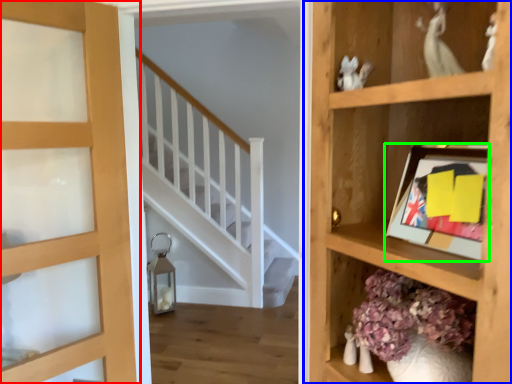
Question: Which is farther away from door (highlighted by a red box)? shelf (highlighted by a blue box) or picture frame (highlighted by a green box)?

Choices:
 (A) shelf
 (B) picture frame

Answer: (B)